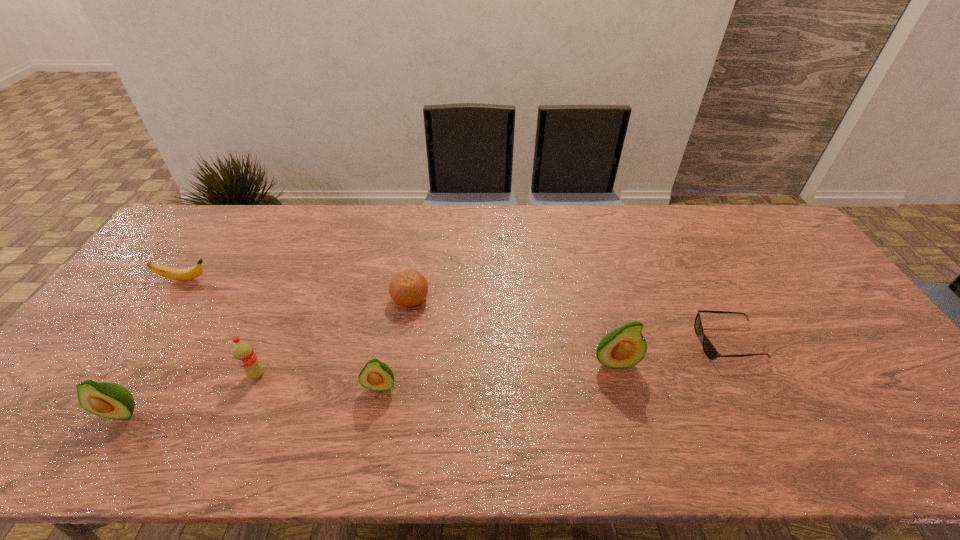
Given the evenly spaced avocados in the image, where should an extra avocado be added on the right to preserve the spacing? Please point to a vacant space. Please provide its 2D coordinates. Your answer should be formatted as a tuple, i.e. [(x, y)], where the tuple contains the x and y coordinates of a point satisfying the conditions above.

[(828, 340)]